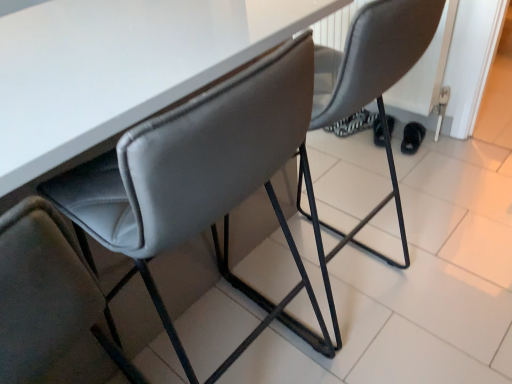
Question: Is suede-like gray chair at center, the 1th chair from the left, to the left of black fuzzy slipper at lower right from the viewer's perspective?

Choices:
 (A) yes
 (B) no

Answer: (A)

Question: From a real-world perspective, is suede-like gray chair at center, which ranks as the 2th chair in right-to-left order, positioned over black fuzzy slipper at lower right based on gravity?

Choices:
 (A) yes
 (B) no

Answer: (A)

Question: Can you confirm if suede-like gray chair at center, the 1th chair from the left, is positioned to the right of black fuzzy slipper at lower right?

Choices:
 (A) yes
 (B) no

Answer: (B)

Question: Is the depth of suede-like gray chair at center, the 1th chair from the left, less than that of black fuzzy slipper at lower right?

Choices:
 (A) yes
 (B) no

Answer: (A)

Question: Is suede-like gray chair at center, the 1th chair from the left, positioned beyond the bounds of black fuzzy slipper at lower right?

Choices:
 (A) yes
 (B) no

Answer: (A)

Question: Is suede-like gray chair at center, the 1th chair from the left, to the left or to the right of matte gray chair at center, the 2th chair viewed from the left, in the image?

Choices:
 (A) left
 (B) right

Answer: (A)

Question: In terms of width, does suede-like gray chair at center, which ranks as the 2th chair in right-to-left order, look wider or thinner when compared to matte gray chair at center, the first chair when ordered from right to left?

Choices:
 (A) thin
 (B) wide

Answer: (B)

Question: From the image's perspective, is suede-like gray chair at center, the 1th chair from the left, positioned above or below matte gray chair at center, the first chair when ordered from right to left?

Choices:
 (A) below
 (B) above

Answer: (B)

Question: In terms of size, does suede-like gray chair at center, which ranks as the 2th chair in right-to-left order, appear bigger or smaller than matte gray chair at center, the 2th chair viewed from the left?

Choices:
 (A) big
 (B) small

Answer: (A)

Question: In terms of height, does suede-like gray chair at center, the 1th chair from the left, look taller or shorter compared to black fuzzy slipper at lower right?

Choices:
 (A) tall
 (B) short

Answer: (A)

Question: Is suede-like gray chair at center, the 1th chair from the left, wider or thinner than black fuzzy slipper at lower right?

Choices:
 (A) wide
 (B) thin

Answer: (A)

Question: Is point (247, 155) closer or farther from the camera than point (415, 148)?

Choices:
 (A) farther
 (B) closer

Answer: (B)

Question: Relative to black fuzzy slipper at lower right, is suede-like gray chair at center, which ranks as the 2th chair in right-to-left order, in front or behind?

Choices:
 (A) front
 (B) behind

Answer: (A)

Question: From a real-world perspective, is matte gray chair at center, the first chair when ordered from right to left, positioned above or below black fuzzy slipper at lower right?

Choices:
 (A) above
 (B) below

Answer: (A)

Question: Is matte gray chair at center, the first chair when ordered from right to left, spatially inside black fuzzy slipper at lower right, or outside of it?

Choices:
 (A) outside
 (B) inside

Answer: (A)